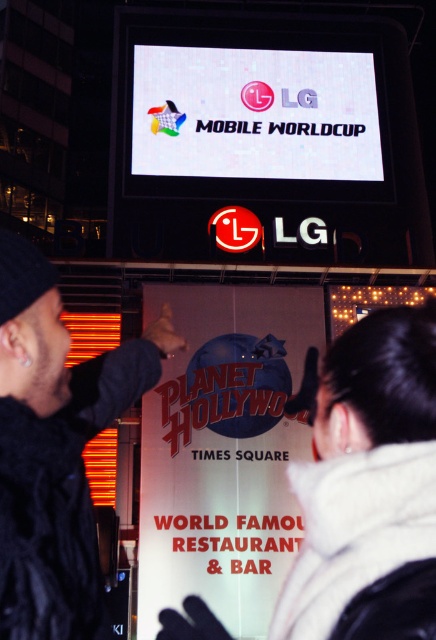
Question: Among these points, which one is farthest from the camera?

Choices:
 (A) (326, 74)
 (B) (159, 502)

Answer: (A)

Question: Is white paper sign at center positioned in front of black fuzzy hat at upper left?

Choices:
 (A) yes
 (B) no

Answer: (B)

Question: Which object is farther from the camera taking this photo?

Choices:
 (A) white paper sign at center
 (B) white glossy screen at upper center
 (C) black fuzzy hat at upper left

Answer: (B)

Question: Which point appears farthest from the camera in this image?

Choices:
 (A) (205, 600)
 (B) (186, 61)

Answer: (B)

Question: Observing the image, what is the correct spatial positioning of white paper sign at center in reference to white glossy screen at upper center?

Choices:
 (A) below
 (B) above

Answer: (A)

Question: Is white paper sign at center positioned at the back of black fuzzy hat at upper left?

Choices:
 (A) no
 (B) yes

Answer: (B)